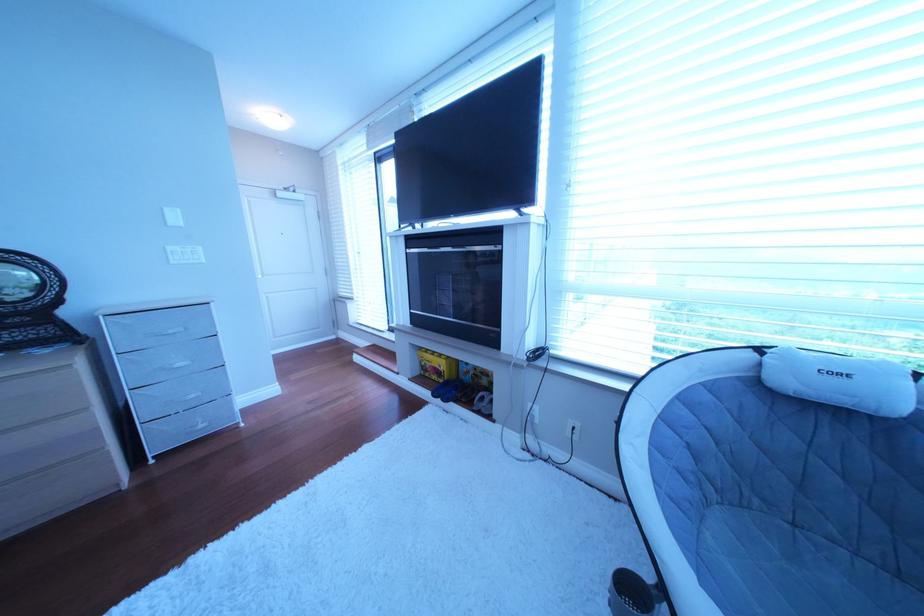
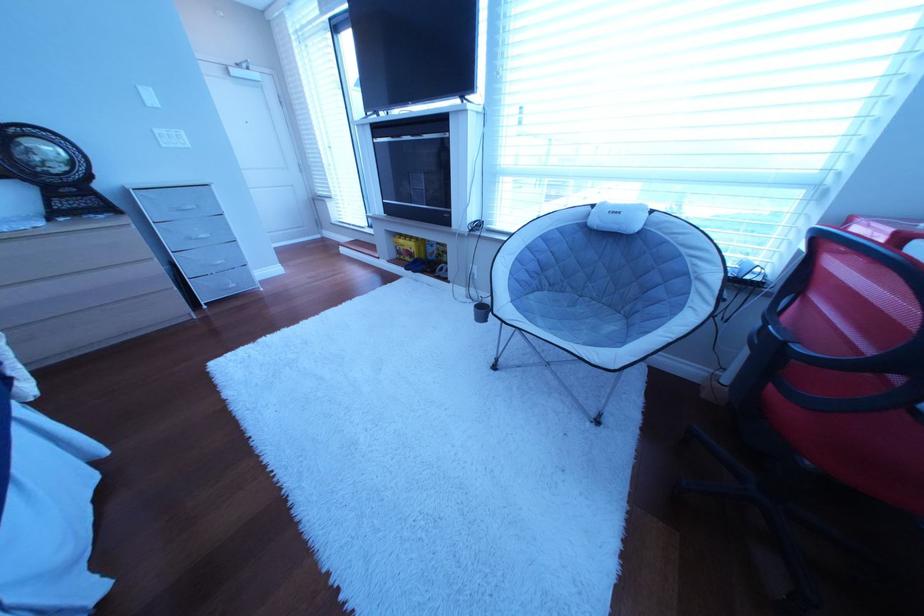
Where in the second image is the point corresponding to the point at 444,367 from the first image?

(418, 251)